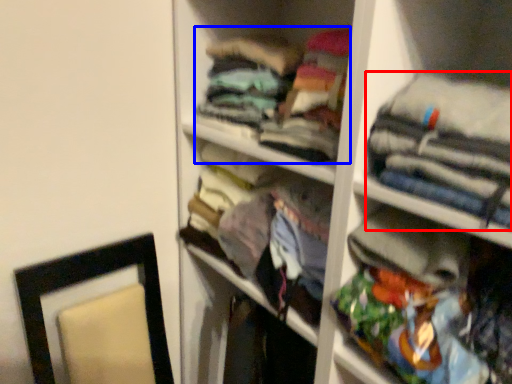
Question: Which point is closer to the camera, clothing (highlighted by a red box) or clothing (highlighted by a blue box)?

Choices:
 (A) clothing
 (B) clothing

Answer: (A)